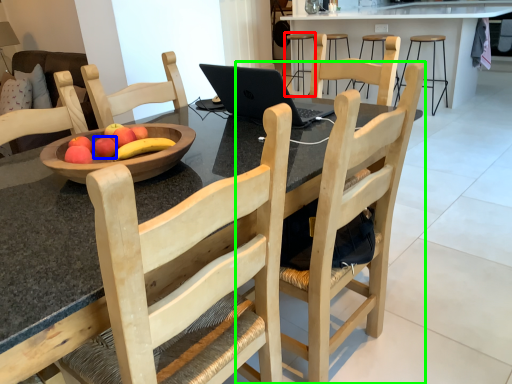
Question: Which object is positioned farthest from bar stool (highlighted by a red box)? Select from apple (highlighted by a blue box) and chair (highlighted by a green box).

Choices:
 (A) apple
 (B) chair

Answer: (A)